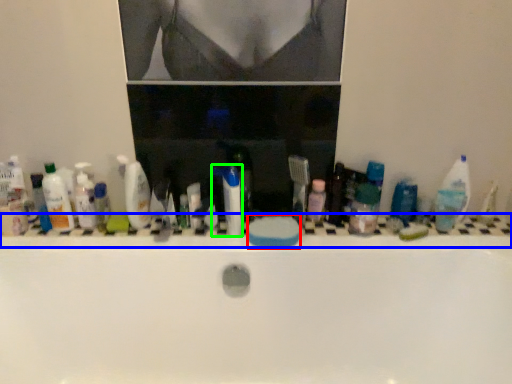
Question: Based on their relative distances, which object is farther from soap (highlighted by a red box)? Choose from ledge (highlighted by a blue box) and toothpaste (highlighted by a green box).

Choices:
 (A) ledge
 (B) toothpaste

Answer: (A)